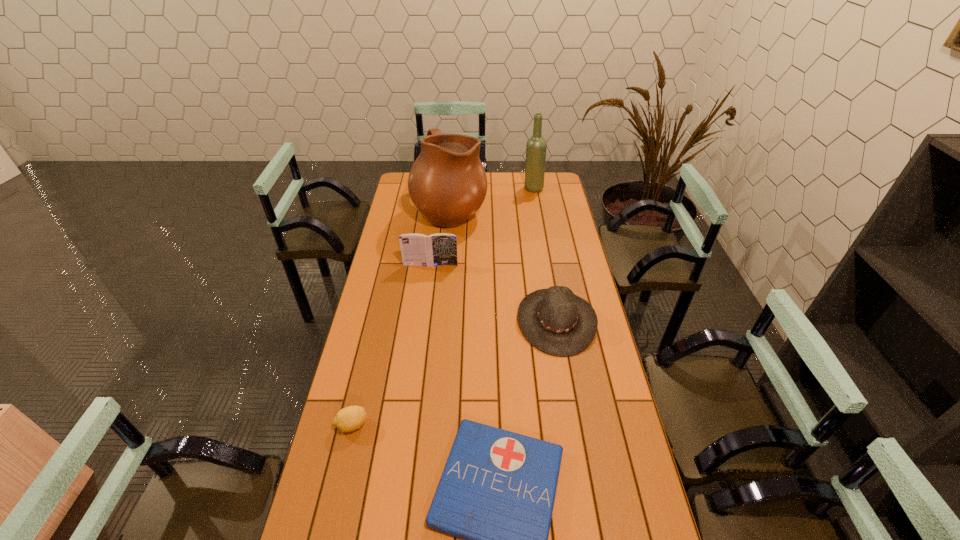
Locate an element on the screen. wine bottle positioned at the right edge is located at coordinates (536, 146).

In order to click on hat at the right edge in this screenshot , I will do 555,321.

Where is `object at the far left corner`? object at the far left corner is located at coordinates (447, 183).

Identify the location of object at the far right corner. The width and height of the screenshot is (960, 540). (536, 146).

The height and width of the screenshot is (540, 960). In the image, there is a desktop. Find the location of `free space at the far edge`. free space at the far edge is located at coordinates (492, 179).

In the image, there is a desktop. Where is `vacant space at the left edge`? The width and height of the screenshot is (960, 540). vacant space at the left edge is located at coordinates (321, 531).

I want to click on vacant space at the right edge of the desktop, so click(615, 427).

Where is `unoccupied area between the wine bottle and the third tallest object`? unoccupied area between the wine bottle and the third tallest object is located at coordinates (482, 227).

Identify the location of vacant point located between the lemon and the cream pitcher. (401, 317).

Find the location of a particular element. This screenshot has height=540, width=960. free space between the leftmost object and the fourth tallest object is located at coordinates (454, 373).